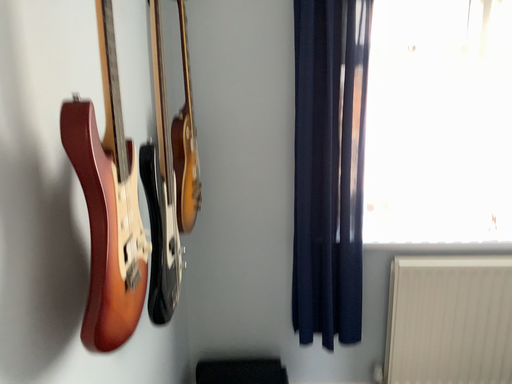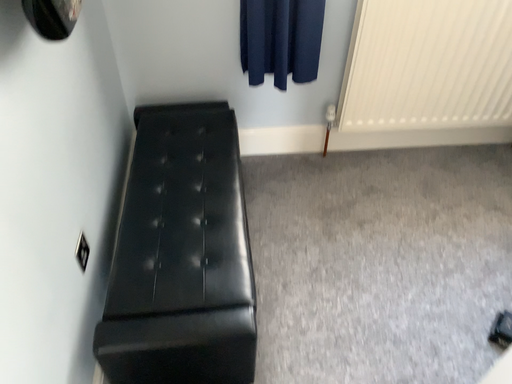
Question: Which way did the camera rotate in the video?

Choices:
 (A) rotated right
 (B) rotated left

Answer: (A)